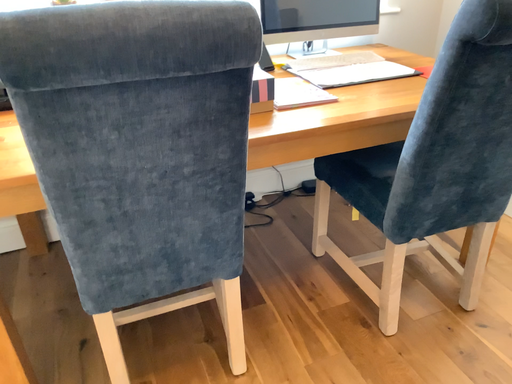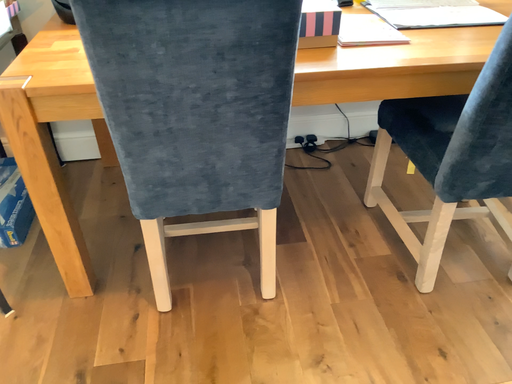
Question: Which way did the camera rotate in the video?

Choices:
 (A) rotated downward
 (B) rotated upward

Answer: (A)